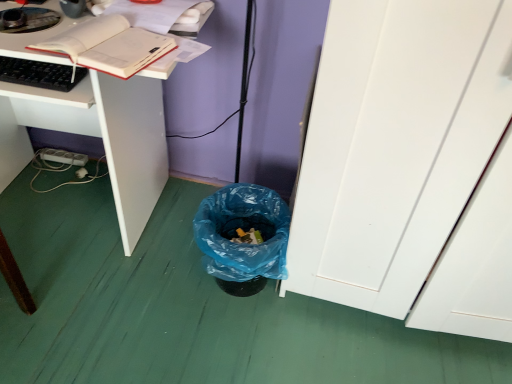
Locate an element on the screen. unoccupied area in front of white matte desk at lower left is located at coordinates (89, 315).